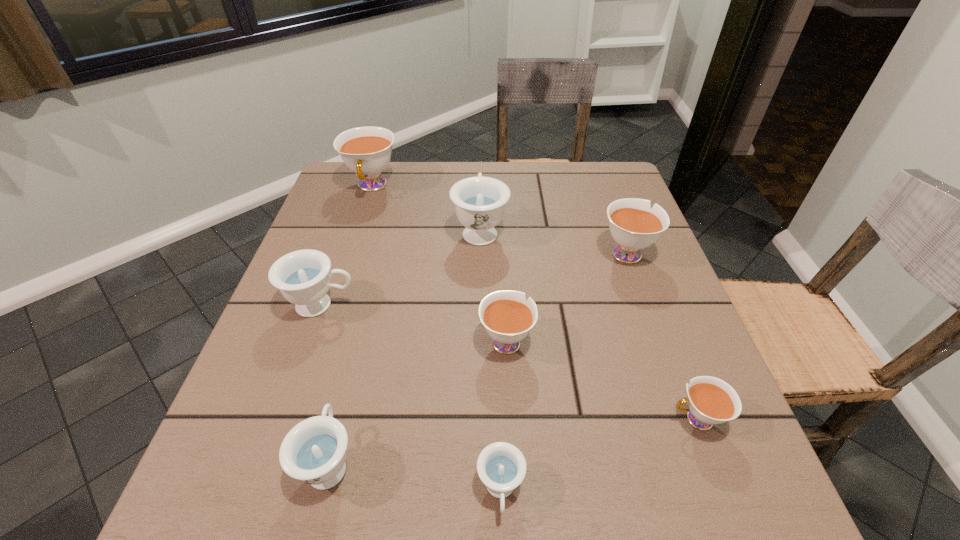
The height and width of the screenshot is (540, 960). Identify the location of free space located 0.110m on the side of the third farthest white teacup with the handle. (503, 278).

What are the coordinates of `vacant space located 0.140m on the side of the third biggest blue teacup with the handle` in the screenshot? It's located at (356, 355).

I want to click on blank area located 0.070m on the side of the third biggest blue teacup with the handle, so click(348, 388).

At what (x,y) coordinates should I click in order to perform the action: click on vacant space positioned on the side of the third biggest blue teacup with the handle. Please return your answer as a coordinate pair (x, y). Looking at the image, I should click on (372, 289).

Locate an element on the screen. vacant area situated on the side of the smallest white teacup with the handle is located at coordinates (456, 419).

Image resolution: width=960 pixels, height=540 pixels. In order to click on vacant region located on the side of the smallest white teacup with the handle in this screenshot , I will do `click(529, 419)`.

Identify the location of free space located 0.260m on the side of the smallest white teacup with the handle. (511, 419).

You are a GUI agent. You are given a task and a screenshot of the screen. Output one action in this format:
    pyautogui.click(x=<x>, y=<y>)
    Task: Click on the object present at the far left corner
    
    Given the screenshot: What is the action you would take?
    pyautogui.click(x=366, y=151)

What are the coordinates of `object located at the near left corner` in the screenshot? It's located at (314, 451).

In order to click on vacant space at the far edge of the desktop in this screenshot , I will do `click(445, 174)`.